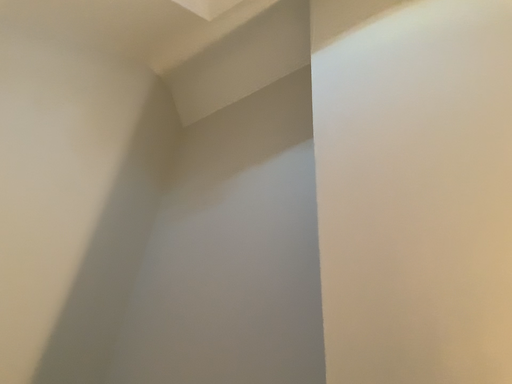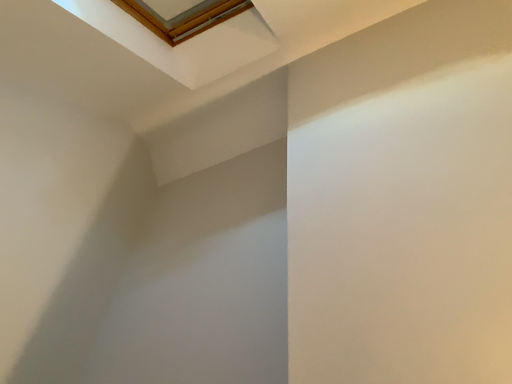
Question: Which way did the camera rotate in the video?

Choices:
 (A) rotated downward
 (B) rotated upward

Answer: (B)